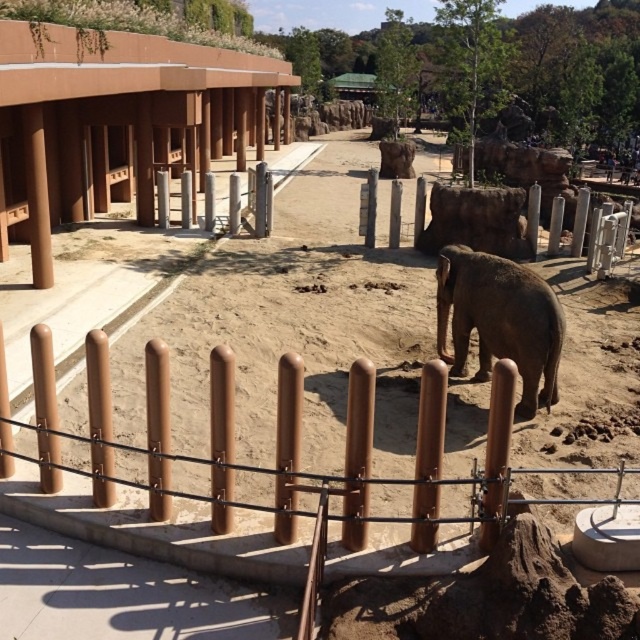
Looking at this image, you are a zookeeper trying to ensure visitor safety. You notice the brown matte fence at center and the gray matte elephant at center. Which object is taller and could potentially block the visitors from seeing the elephant?

The gray matte elephant at center is taller than the brown matte fence at center, so it could potentially block the visitors from seeing the elephant.

You are a zookeeper planning to feed the gray matte elephant at center. You need to place a food bin between the brown matte fence at center and the elephant. Given that the fence is larger than the elephant, which object should you position the bin closer to?

The brown matte fence at center is bigger than the gray matte elephant at center, so you should position the food bin closer to the gray matte elephant at center to ensure there is enough space between the larger fence and the elephant.

You are standing in the zoo enclosure and want to take a photo of the elephant without the brown matte fence at center blocking the view. Where should you position yourself relative to the fence?

To avoid the brown matte fence at center blocking the view, position yourself either to the left or right of the fence, as it is located at coordinates point (275, 444) in the center area.